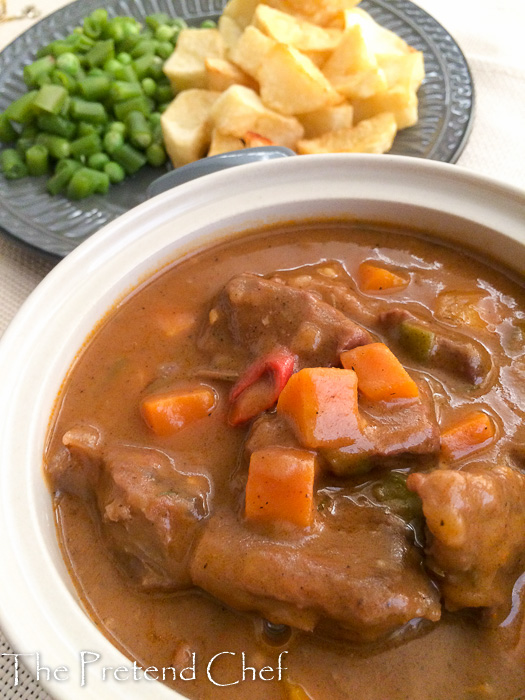
Identify the location of plate. (89, 304), (58, 223).